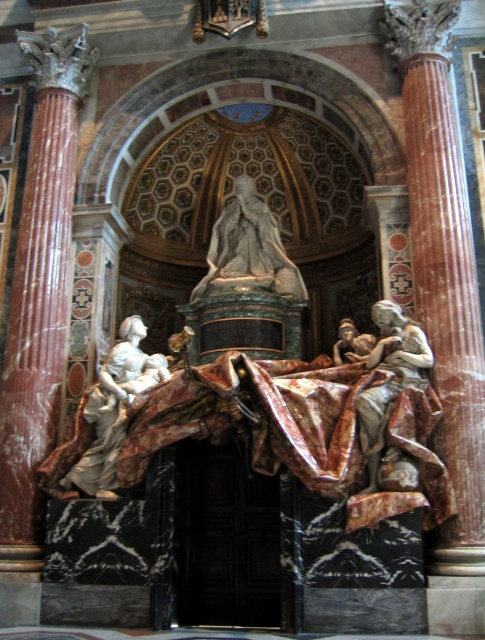
Who is taller, marble column at left or marble statue at center?

marble column at left

Does marble column at left have a larger size compared to marble statue at center?

Yes.

Is point (42, 74) closer to camera compared to point (294, 291)?

No, it is not.

You are a GUI agent. You are given a task and a screenshot of the screen. Output one action in this format:
    pyautogui.click(x=<x>, y=<y>)
    Task: Click on the marble column at left
    The width and height of the screenshot is (485, 640).
    Given the screenshot: What is the action you would take?
    pyautogui.click(x=39, y=288)

Can you confirm if marble column at left is positioned below marble statue of woman holding child at left?

Actually, marble column at left is above marble statue of woman holding child at left.

Where is `marble column at left`? This screenshot has height=640, width=485. marble column at left is located at coordinates (39, 288).

Locate an element on the screen. The height and width of the screenshot is (640, 485). marble column at left is located at coordinates (39, 288).

Locate an element on the screen. This screenshot has height=640, width=485. marble column at left is located at coordinates (39, 288).

Is marble statue of woman holding child at left to the left of marble statue at center from the viewer's perspective?

Indeed, marble statue of woman holding child at left is positioned on the left side of marble statue at center.

Is point (104, 364) positioned in front of point (237, 228)?

Yes, point (104, 364) is closer to viewer.

Which is in front, point (123, 356) or point (251, 193)?

Positioned in front is point (123, 356).

Image resolution: width=485 pixels, height=640 pixels. I want to click on marble statue of woman holding child at left, so click(x=113, y=406).